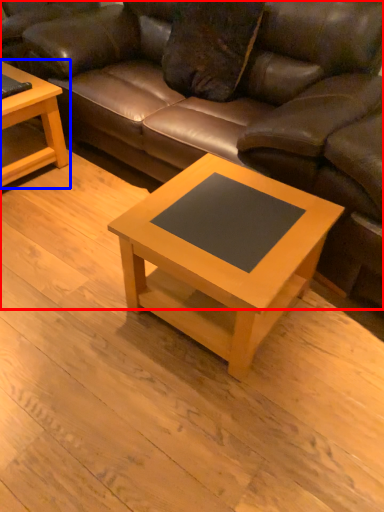
Question: Which of the following is the farthest to the observer, studio couch (highlighted by a red box) or coffee table (highlighted by a blue box)?

Choices:
 (A) studio couch
 (B) coffee table

Answer: (B)